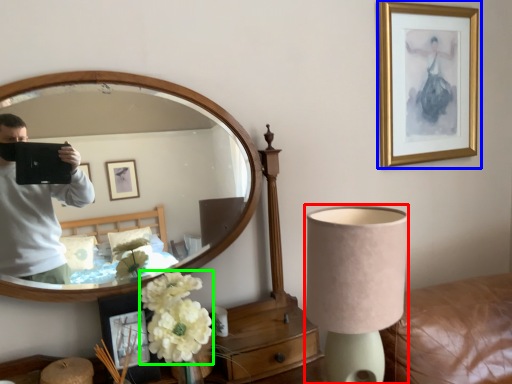
Question: Based on their relative distances, which object is farther from lamp (highlighted by a red box)? Choose from picture frame (highlighted by a blue box) and flower (highlighted by a green box).

Choices:
 (A) picture frame
 (B) flower

Answer: (A)